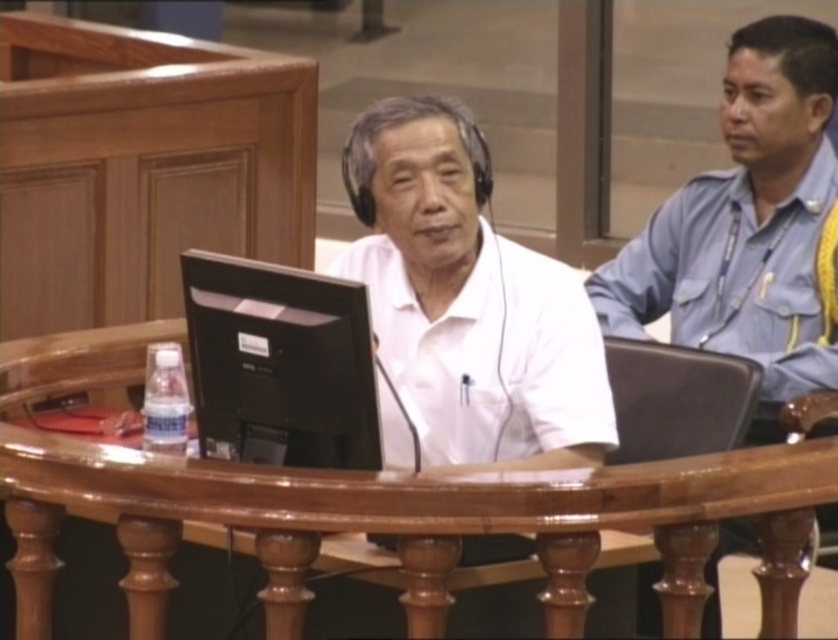
Question: Can you confirm if white matte shirt at center is smaller than black matte monitor at center?

Choices:
 (A) yes
 (B) no

Answer: (B)

Question: Can you confirm if white matte shirt at center is smaller than black matte monitor at center?

Choices:
 (A) yes
 (B) no

Answer: (B)

Question: Among these points, which one is farthest from the camera?

Choices:
 (A) (215, 412)
 (B) (458, 401)

Answer: (B)

Question: Where is white matte shirt at center located in relation to black matte monitor at center in the image?

Choices:
 (A) above
 (B) below

Answer: (A)

Question: Among these objects, which one is nearest to the camera?

Choices:
 (A) black matte monitor at center
 (B) white matte shirt at center

Answer: (A)

Question: Which point is farther to the camera?

Choices:
 (A) (363, 285)
 (B) (371, 116)

Answer: (B)